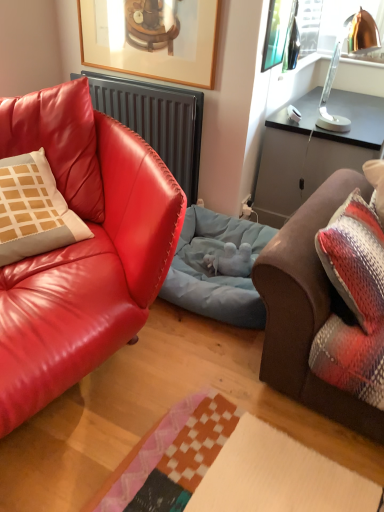
Question: Is wooden framed picture at upper center inside or outside of brown leather couch at right, which appears as the first studio couch when viewed from the right?

Choices:
 (A) outside
 (B) inside

Answer: (A)

Question: From the image's perspective, is wooden framed picture at upper center above or below brown leather couch at right, which appears as the first studio couch when viewed from the right?

Choices:
 (A) below
 (B) above

Answer: (B)

Question: Estimate the real-world distances between objects in this image. Which object is closer to the matte black radiator at left?

Choices:
 (A) copper metallic lamp at upper right
 (B) light blue fabric dog bed at center
 (C) brown leather couch at right, which appears as the first studio couch when viewed from the right
 (D) matte white pillow with brown grid at left
 (E) wooden framed picture at upper center

Answer: (E)

Question: Estimate the real-world distances between objects in this image. Which object is closer to the matte red leather couch at left, the first studio couch from the left?

Choices:
 (A) brown leather couch at right, the 2th studio couch from the left
 (B) copper metallic lamp at upper right
 (C) light blue fabric dog bed at center
 (D) wooden framed picture at upper center
 (E) matte black radiator at left

Answer: (C)